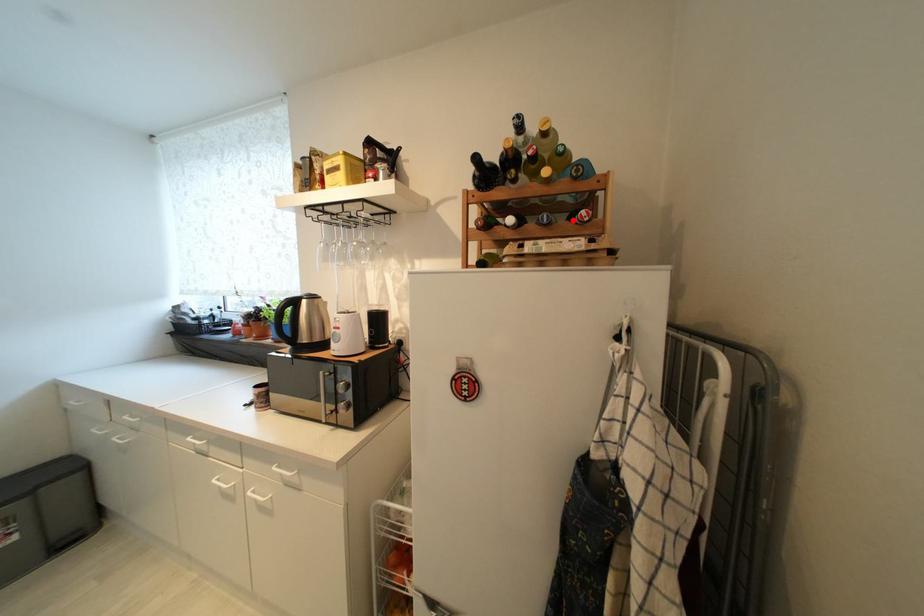
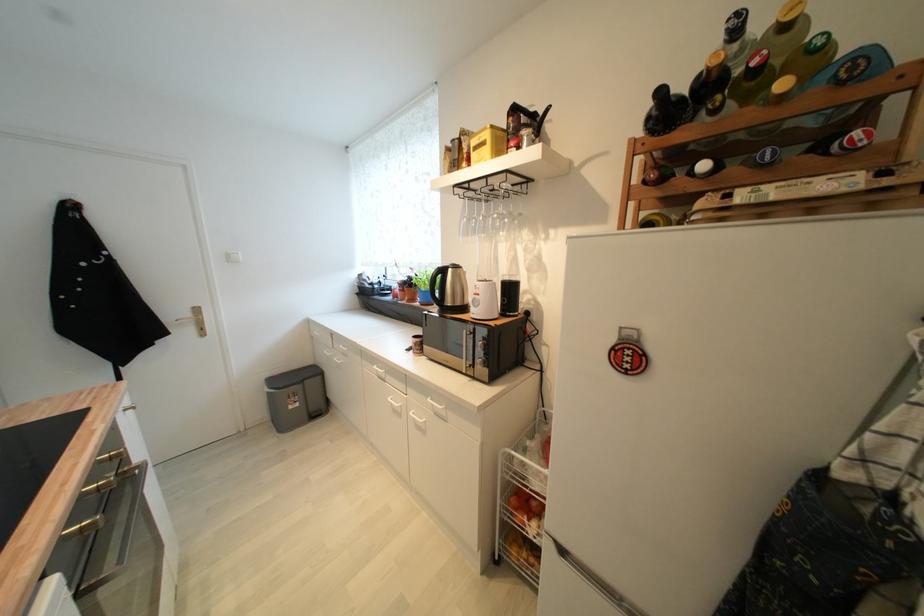
In the second image, find the point that corresponds to the highlighted location in the first image.

(813, 153)